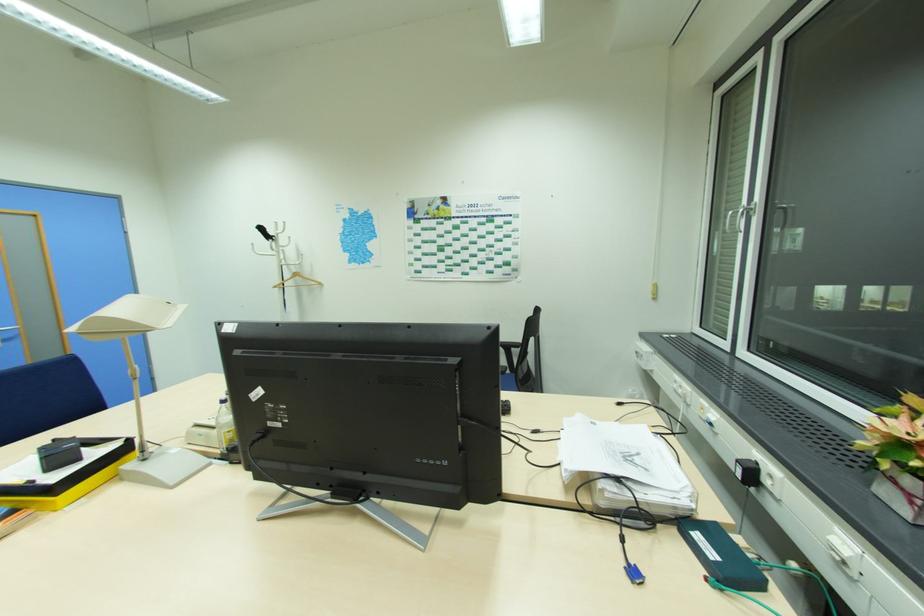
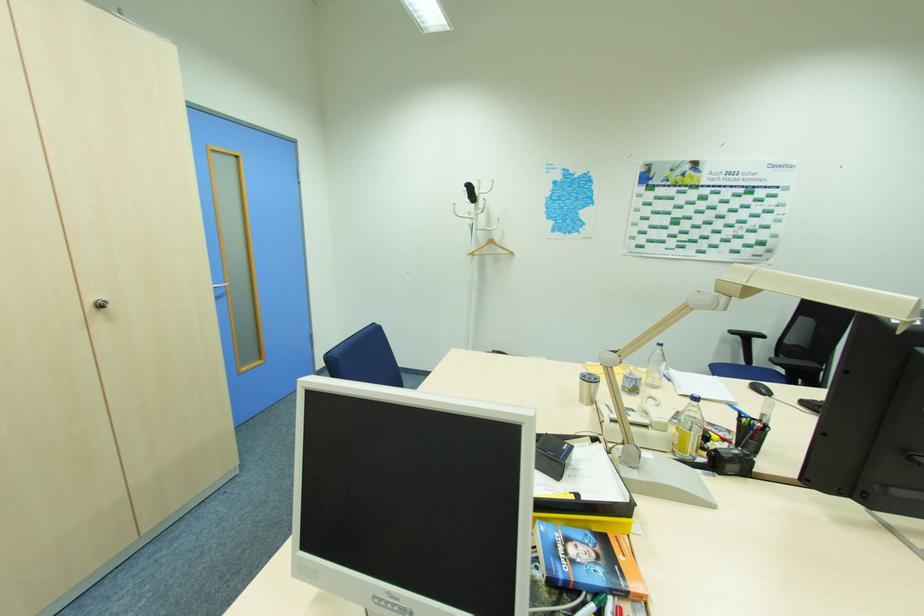
In the second image, find the point that corresponds to [277,286] in the first image.

(472, 254)